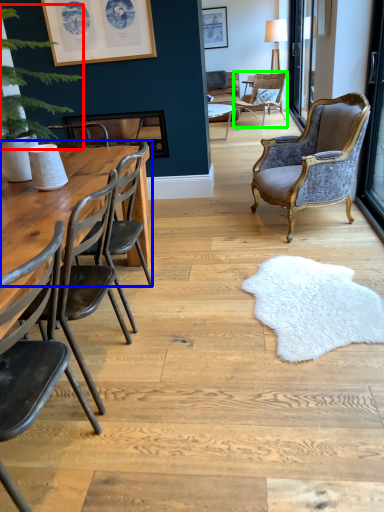
Question: Estimate the real-world distances between objects in this image. Which object is closer to plant (highlighted by a red box), table (highlighted by a blue box) or chair (highlighted by a green box)?

Choices:
 (A) table
 (B) chair

Answer: (A)